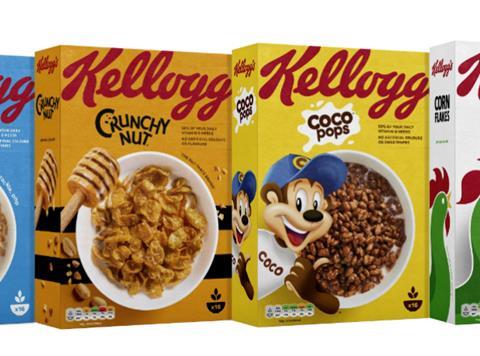
Locate an element on the screen. bowl of cereal is located at coordinates (148, 232), (341, 231).